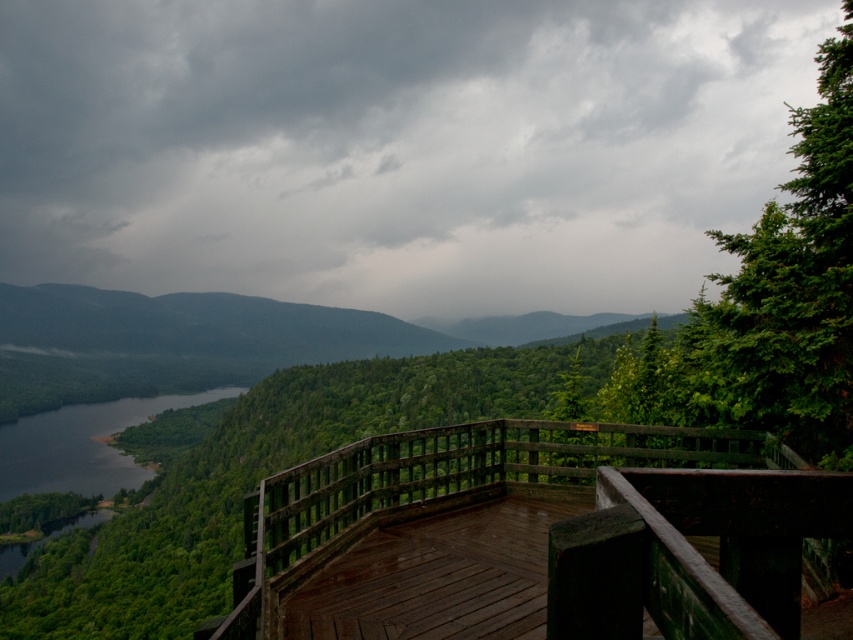
Question: Can you confirm if dark gray cloud at upper center is positioned to the left of wooden deck at center?

Choices:
 (A) yes
 (B) no

Answer: (A)

Question: Among these points, which one is farthest from the camera?

Choices:
 (A) (466, 598)
 (B) (592, 40)

Answer: (B)

Question: Which object is farther from the camera taking this photo?

Choices:
 (A) wooden deck at center
 (B) dark gray cloud at upper center

Answer: (B)

Question: Is dark gray cloud at upper center above wooden deck at center?

Choices:
 (A) yes
 (B) no

Answer: (A)

Question: Is dark gray cloud at upper center above wooden deck at center?

Choices:
 (A) yes
 (B) no

Answer: (A)